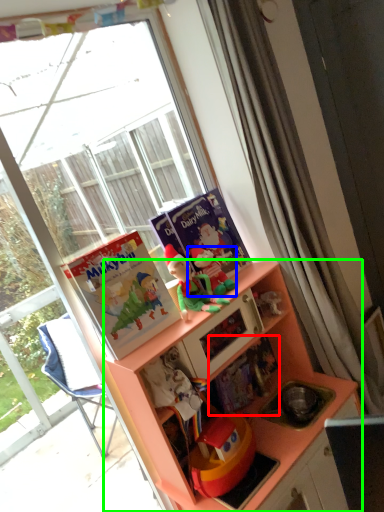
Question: Which object is positioned closest to book (highlighted by a red box)? Select from toy (highlighted by a blue box) and cabinetry (highlighted by a green box).

Choices:
 (A) toy
 (B) cabinetry

Answer: (B)